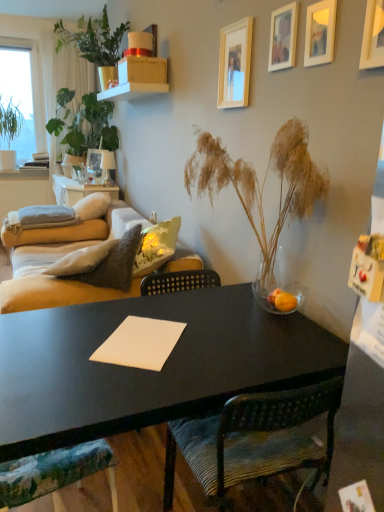
Question: From the image's perspective, is matte cardboard box at upper center on gray fabric pillow at left, the second pillow viewed from the right?

Choices:
 (A) no
 (B) yes

Answer: (B)

Question: Can you confirm if matte cardboard box at upper center is bigger than gray fabric pillow at left, the second pillow viewed from the right?

Choices:
 (A) yes
 (B) no

Answer: (B)

Question: Is matte cardboard box at upper center positioned behind gray fabric pillow at left, marked as the 1th pillow in a left-to-right arrangement?

Choices:
 (A) no
 (B) yes

Answer: (A)

Question: Is matte cardboard box at upper center positioned with its back to gray fabric pillow at left, marked as the 1th pillow in a left-to-right arrangement?

Choices:
 (A) yes
 (B) no

Answer: (B)

Question: Considering the relative sizes of matte cardboard box at upper center and gray fabric pillow at left, marked as the 1th pillow in a left-to-right arrangement, in the image provided, is matte cardboard box at upper center taller than gray fabric pillow at left, marked as the 1th pillow in a left-to-right arrangement,?

Choices:
 (A) yes
 (B) no

Answer: (A)

Question: Is translucent glass vase at center, the 4th houseplant when ordered from left to right, in front of or behind wooden picture frame at upper right, which is counted as the second picture frame, starting from the front, in the image?

Choices:
 (A) front
 (B) behind

Answer: (A)

Question: Which is correct: translucent glass vase at center, which ranks as the first houseplant in front-to-back order, is inside wooden picture frame at upper right, placed as the fourth picture frame when sorted from back to front, or outside of it?

Choices:
 (A) outside
 (B) inside

Answer: (A)

Question: From the image's perspective, is translucent glass vase at center, acting as the fourth houseplant starting from the back, located above or below wooden picture frame at upper right, which is counted as the second picture frame, starting from the front?

Choices:
 (A) above
 (B) below

Answer: (B)

Question: From a real-world perspective, is translucent glass vase at center, acting as the fourth houseplant starting from the back, above or below wooden picture frame at upper right, the 4th picture frame in the left-to-right sequence?

Choices:
 (A) below
 (B) above

Answer: (A)

Question: Is striped fabric chair at center, which appears as the 1th chair when viewed from the right, in front of or behind translucent glass vase at center, which is the first houseplant in right-to-left order, in the image?

Choices:
 (A) front
 (B) behind

Answer: (A)

Question: Does point (289, 401) appear closer or farther from the camera than point (274, 234)?

Choices:
 (A) closer
 (B) farther

Answer: (A)

Question: From the image's perspective, is striped fabric chair at center, placed as the second chair when sorted from left to right, positioned above or below translucent glass vase at center, which is the first houseplant in right-to-left order?

Choices:
 (A) below
 (B) above

Answer: (A)

Question: From a real-world perspective, relative to translucent glass vase at center, which ranks as the first houseplant in front-to-back order, is striped fabric chair at center, which appears as the 1th chair when viewed from the right, vertically above or below?

Choices:
 (A) above
 (B) below

Answer: (B)

Question: Looking at the image, does gray fabric pillow at left, marked as the 1th pillow in a left-to-right arrangement, seem bigger or smaller compared to wooden picture frame at upper center, arranged as the 4th picture frame when viewed from the right?

Choices:
 (A) big
 (B) small

Answer: (A)

Question: Considering the positions of point (59, 208) and point (248, 26), is point (59, 208) closer or farther from the camera than point (248, 26)?

Choices:
 (A) farther
 (B) closer

Answer: (A)